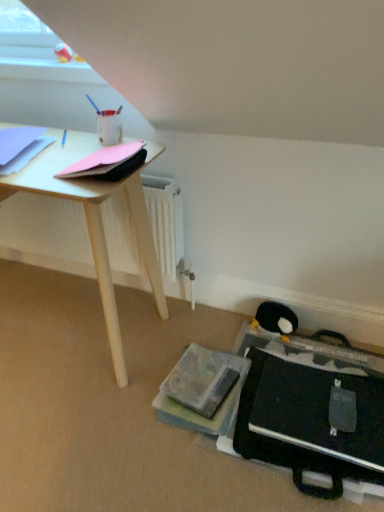
Question: Considering the relative sizes of light blue paper at upper left, which is the 1th paperback book in left-to-right order, and pink matte paper at upper left, which appears as the 1th paperback book when viewed from the right, in the image provided, is light blue paper at upper left, which is the 1th paperback book in left-to-right order, smaller than pink matte paper at upper left, which appears as the 1th paperback book when viewed from the right,?

Choices:
 (A) no
 (B) yes

Answer: (A)

Question: Could you tell me if light blue paper at upper left, which is counted as the second paperback book, starting from the right, is turned towards pink matte paper at upper left, which is the 2th paperback book from left to right?

Choices:
 (A) no
 (B) yes

Answer: (A)

Question: Is light blue paper at upper left, which is the 1th paperback book in left-to-right order, thinner than pink matte paper at upper left, which appears as the 1th paperback book when viewed from the right?

Choices:
 (A) yes
 (B) no

Answer: (B)

Question: Is pink matte paper at upper left, which appears as the 1th paperback book when viewed from the right, at the back of light blue paper at upper left, which is the 1th paperback book in left-to-right order?

Choices:
 (A) yes
 (B) no

Answer: (B)

Question: Does light blue paper at upper left, which is the 1th paperback book in left-to-right order, have a greater height compared to pink matte paper at upper left, which appears as the 1th paperback book when viewed from the right?

Choices:
 (A) yes
 (B) no

Answer: (B)

Question: From their relative heights in the image, would you say light blue paper at upper left, which is the 1th paperback book in left-to-right order, is taller or shorter than pink matte paper at upper left, which is the 2th paperback book from left to right?

Choices:
 (A) tall
 (B) short

Answer: (B)

Question: From a real-world perspective, is light blue paper at upper left, which is the 1th paperback book in left-to-right order, physically located above or below pink matte paper at upper left, which is the 2th paperback book from left to right?

Choices:
 (A) below
 (B) above

Answer: (A)

Question: Is light blue paper at upper left, which is the 1th paperback book in left-to-right order, bigger or smaller than pink matte paper at upper left, which is the 2th paperback book from left to right?

Choices:
 (A) big
 (B) small

Answer: (A)

Question: Would you say light blue paper at upper left, which is counted as the second paperback book, starting from the right, is to the left or to the right of pink matte paper at upper left, which is the 2th paperback book from left to right, in the picture?

Choices:
 (A) left
 (B) right

Answer: (A)

Question: From the image's perspective, relative to light blue paper at upper left, which is the 1th paperback book in left-to-right order, is black plush penguin at lower right above or below?

Choices:
 (A) below
 (B) above

Answer: (A)

Question: Based on their positions, is black plush penguin at lower right located to the left or right of light blue paper at upper left, which is counted as the second paperback book, starting from the right?

Choices:
 (A) left
 (B) right

Answer: (B)

Question: In terms of width, does black plush penguin at lower right look wider or thinner when compared to light blue paper at upper left, which is counted as the second paperback book, starting from the right?

Choices:
 (A) thin
 (B) wide

Answer: (A)

Question: Is point (286, 327) closer or farther from the camera than point (1, 146)?

Choices:
 (A) closer
 (B) farther

Answer: (B)

Question: From a real-world perspective, relative to black plush penguin at lower right, is pink matte paper at upper left, which appears as the 1th paperback book when viewed from the right, vertically above or below?

Choices:
 (A) above
 (B) below

Answer: (A)

Question: Considering the relative positions of pink matte paper at upper left, which appears as the 1th paperback book when viewed from the right, and black plush penguin at lower right in the image provided, is pink matte paper at upper left, which appears as the 1th paperback book when viewed from the right, to the left or to the right of black plush penguin at lower right?

Choices:
 (A) left
 (B) right

Answer: (A)